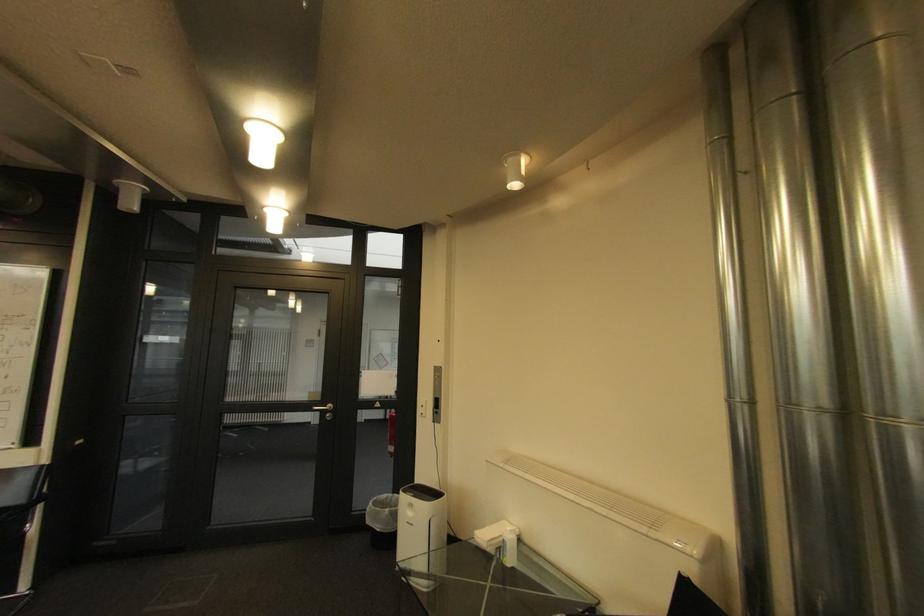
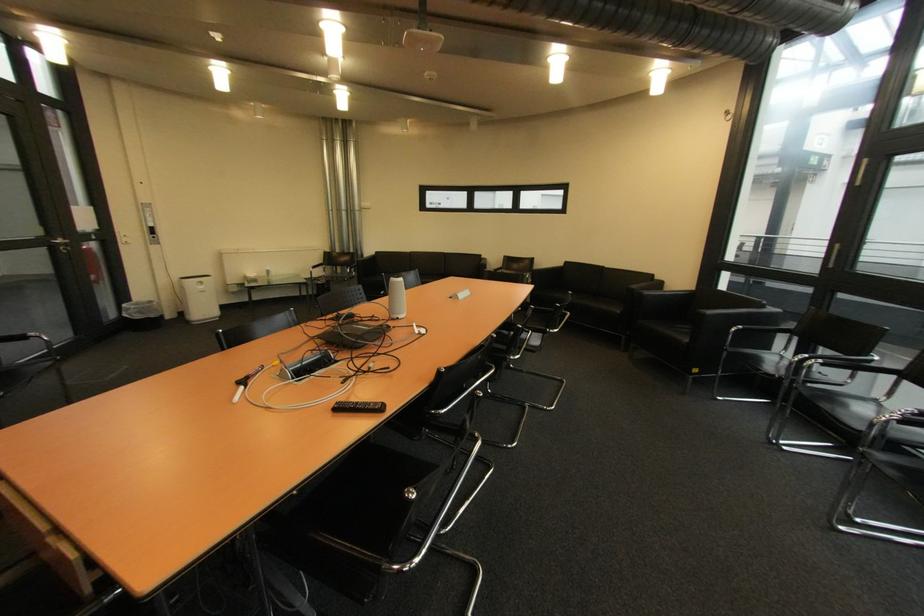
In the second image, find the point that corresponds to pixel 377 523 in the first image.

(147, 318)